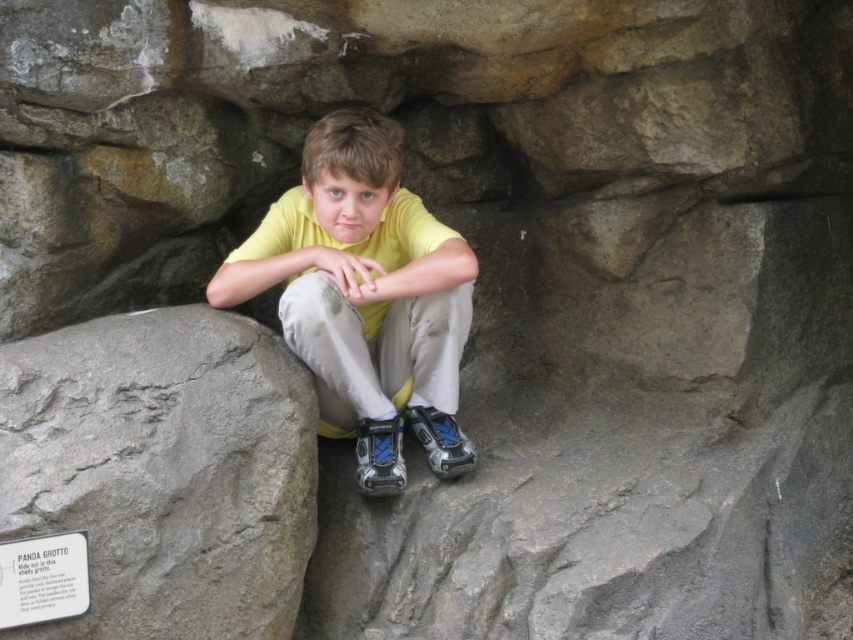
You are standing at the entrance of the grotto and want to place a small flashlight on the rocky surface where the boy is sitting. The boy is currently sitting at point (364, 296). Where should you place the flashlight so that it is directly in front of the boy?

The yellow matte shirt at center is located at point (364, 296). To place the flashlight directly in front of the boy, position it along the line extending from the boy at point (364, 296) towards the direction he is facing, which is towards the camera. Since the boy is sitting at that point and facing the camera, the flashlight should be placed slightly ahead of point (364, 296) in the direction of his gaze.

You are a photographer trying to capture the boy in the yellow matte shirt at center. To avoid including the gray rough rock at lower left in the photo, where should you position the camera relative to the boy?

Since the gray rough rock at lower left is below the yellow matte shirt at center, you should position the camera above the boy to avoid capturing the rock in the photo.

You are a visitor at a zoo and see the gray rough rock at lower left and the white paper sign at lower left. Which object is positioned more to the right side?

The gray rough rock at lower left is positioned more to the right side than the white paper sign at lower left.